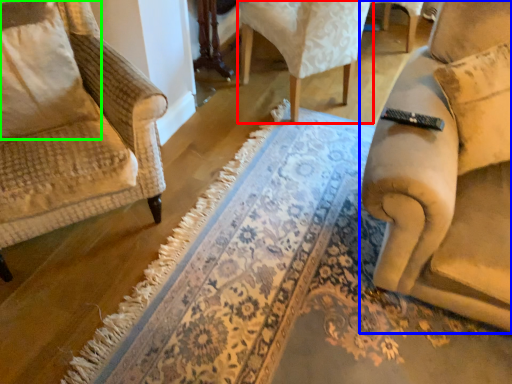
Question: Which object is positioned farthest from chair (highlighted by a red box)? Select from chair (highlighted by a blue box) and pillow (highlighted by a green box).

Choices:
 (A) chair
 (B) pillow

Answer: (B)